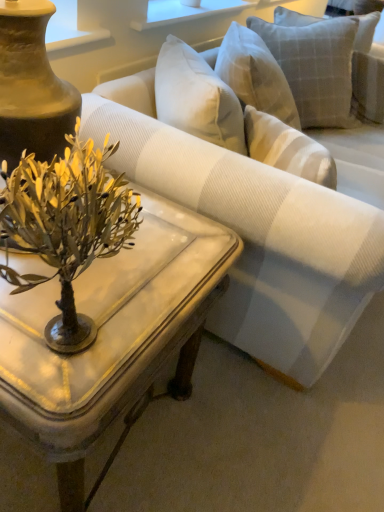
Question: Is point (64, 287) closer or farther from the camera than point (120, 391)?

Choices:
 (A) closer
 (B) farther

Answer: (A)

Question: Looking at the image, does metallic gold plant at center seem bigger or smaller compared to white marble coffee table at center?

Choices:
 (A) big
 (B) small

Answer: (B)

Question: Which of these objects is positioned closest to the white marble coffee table at center?

Choices:
 (A) light gray textured pillow at upper right
 (B) white striped fabric couch at center
 (C) metallic gold plant at center

Answer: (C)

Question: Which object is the farthest from the metallic gold plant at center?

Choices:
 (A) white striped fabric couch at center
 (B) white marble coffee table at center
 (C) light gray textured pillow at upper right

Answer: (C)